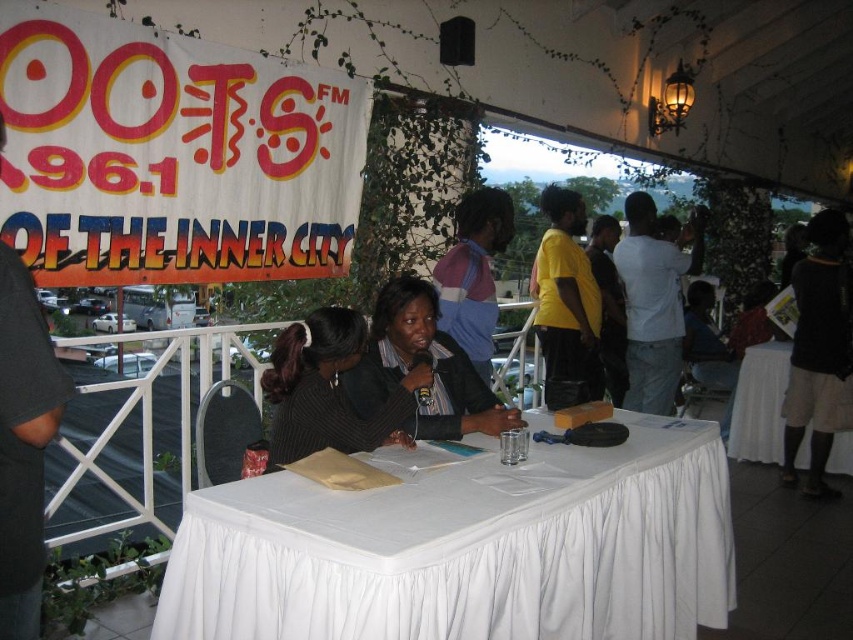
Does white cloth-covered table at center appear on the right side of matte black jacket at center?

Indeed, white cloth-covered table at center is positioned on the right side of matte black jacket at center.

Is white cloth-covered table at center positioned in front of matte black jacket at center?

Yes.

Locate an element on the screen. This screenshot has width=853, height=640. white cloth-covered table at center is located at coordinates (468, 548).

Which is above, white cloth-covered table at center or white cloth-covered table at right?

Positioned higher is white cloth-covered table at right.

Looking at this image, is white cloth-covered table at center taller than white cloth-covered table at right?

Incorrect, white cloth-covered table at center's height is not larger of white cloth-covered table at right's.

Is point (419, 636) positioned after point (730, 449)?

No, (419, 636) is in front of (730, 449).

Locate an element on the screen. The width and height of the screenshot is (853, 640). white cloth-covered table at center is located at coordinates (468, 548).

From the picture: Can you confirm if matte black jacket at center is positioned to the left of white cloth-covered table at right?

Indeed, matte black jacket at center is positioned on the left side of white cloth-covered table at right.

Does point (384, 285) lie behind point (798, 467)?

No, (384, 285) is closer to viewer.

Locate an element on the screen. matte black jacket at center is located at coordinates (427, 364).